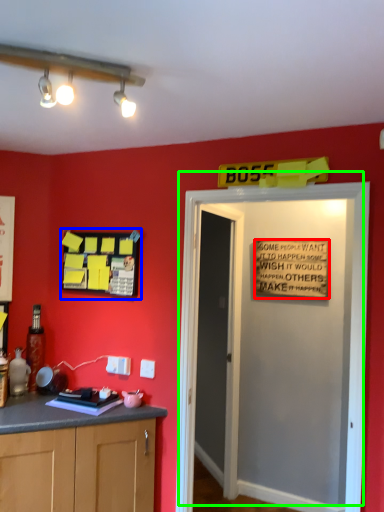
Question: Considering the real-world distances, which object is farthest from warning sign (highlighted by a red box)? bulletin board (highlighted by a blue box) or door (highlighted by a green box)?

Choices:
 (A) bulletin board
 (B) door

Answer: (A)